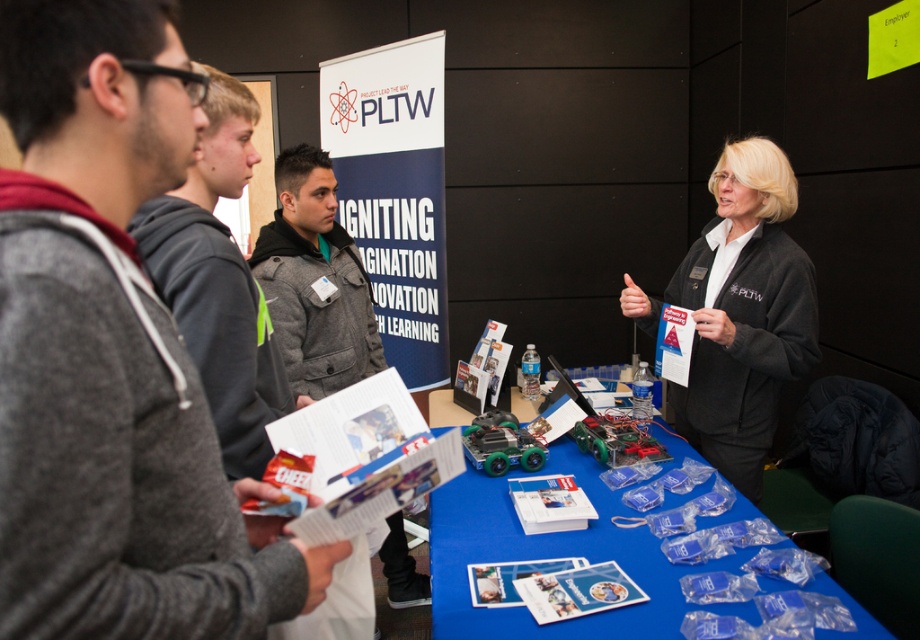
Question: Does blue plastic table at center appear under gray hoodie at left?

Choices:
 (A) yes
 (B) no

Answer: (A)

Question: Is gray hoodie at left further to the viewer compared to gray wool jacket at center?

Choices:
 (A) no
 (B) yes

Answer: (A)

Question: Does black fabric jacket at upper right have a smaller size compared to gray wool jacket at center?

Choices:
 (A) no
 (B) yes

Answer: (A)

Question: Which object is the farthest from the gray wool jacket at center?

Choices:
 (A) gray hoodie at left
 (B) gray sweater at left
 (C) blue plastic table at center
 (D) black fabric jacket at upper right

Answer: (B)

Question: Which object is the closest to the gray hoodie at left?

Choices:
 (A) blue plastic table at center
 (B) black fabric jacket at upper right

Answer: (A)

Question: Among these points, which one is nearest to the camera?

Choices:
 (A) (697, 403)
 (B) (276, 292)
 (C) (132, 104)

Answer: (C)